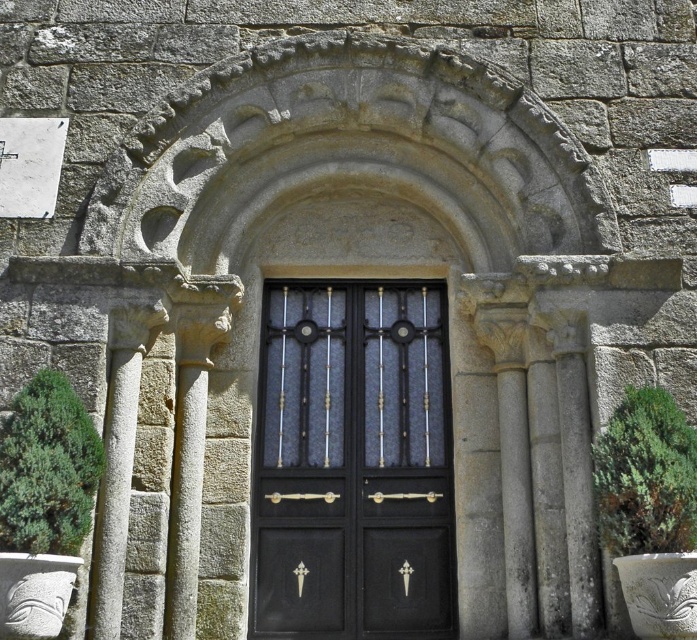
Question: Is green leafy bush at left thinner than green leafy plant at right?

Choices:
 (A) yes
 (B) no

Answer: (A)

Question: Does green leafy bush at left have a smaller size compared to green leafy plant at right?

Choices:
 (A) no
 (B) yes

Answer: (B)

Question: Which point is farther from the camera taking this photo?

Choices:
 (A) (654, 410)
 (B) (77, 413)

Answer: (A)

Question: Does green leafy bush at left lie in front of green leafy plant at right?

Choices:
 (A) yes
 (B) no

Answer: (A)